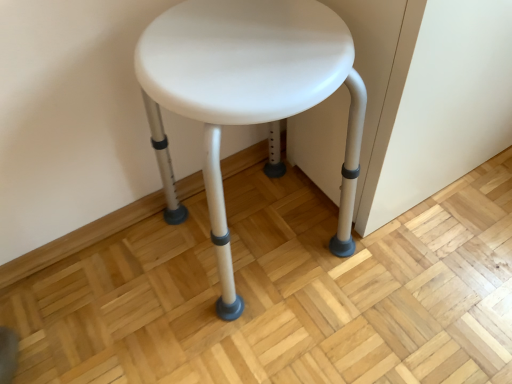
Locate an element on the screen. The height and width of the screenshot is (384, 512). white plastic stool at center is located at coordinates (252, 89).

Describe the element at coordinates (252, 89) in the screenshot. I see `white plastic stool at center` at that location.

In order to face white plastic stool at center, should I rotate leftwards or rightwards?

To face it directly, rotate left by 0.693 degrees.

Where is `white plastic stool at center`? The height and width of the screenshot is (384, 512). white plastic stool at center is located at coordinates (252, 89).